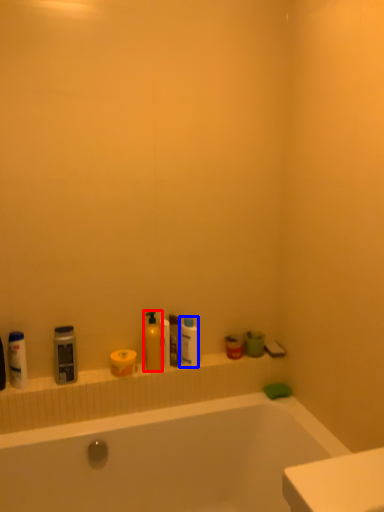
Question: Which object appears farthest to the camera in this image, cleaning product (highlighted by a red box) or toiletry (highlighted by a blue box)?

Choices:
 (A) cleaning product
 (B) toiletry

Answer: (B)